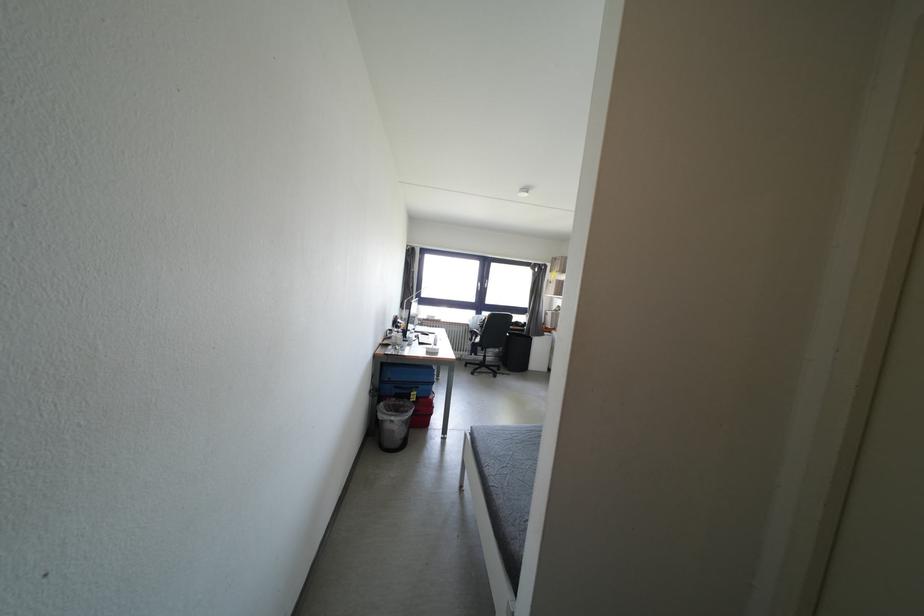
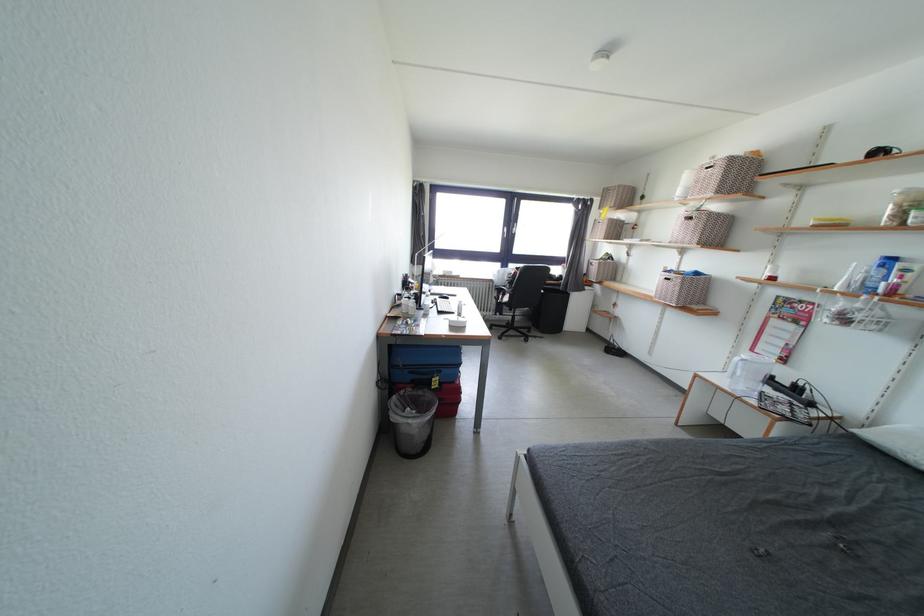
In the second image, find the point that corresponds to (487,318) in the first image.

(514, 270)